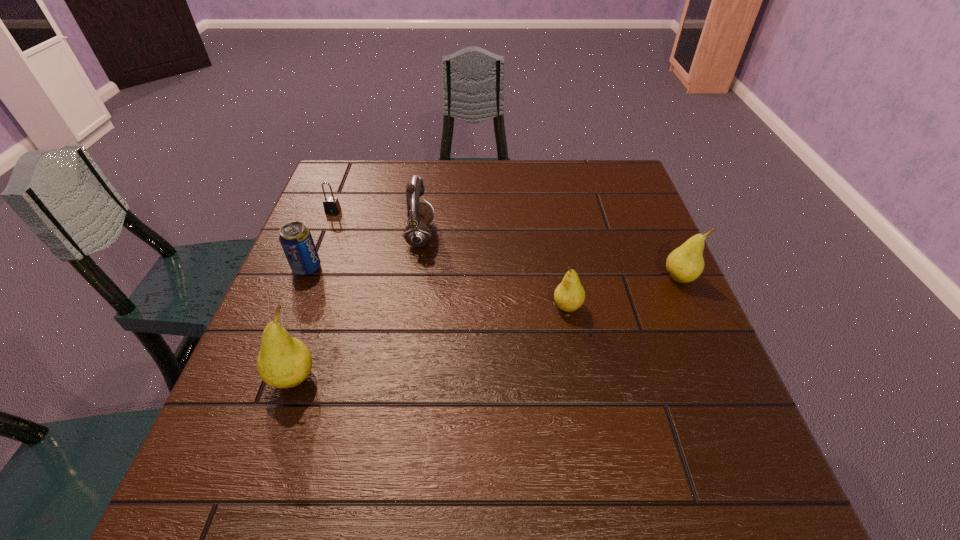
Image resolution: width=960 pixels, height=540 pixels. Identify the location of padlock situated at the left edge. (331, 204).

The width and height of the screenshot is (960, 540). What are the coordinates of `object that is at the right edge` in the screenshot? It's located at (684, 264).

This screenshot has height=540, width=960. I want to click on object located in the near left corner section of the desktop, so click(283, 362).

In the image, there is a desktop. Where is `free space at the far edge`? free space at the far edge is located at coordinates (537, 171).

Locate an element on the screen. vacant point at the near edge is located at coordinates (381, 425).

In the image, there is a desktop. Where is `vacant area at the left edge`? Image resolution: width=960 pixels, height=540 pixels. vacant area at the left edge is located at coordinates (316, 274).

In the image, there is a desktop. Where is `blank space at the right edge`? blank space at the right edge is located at coordinates (653, 223).

Image resolution: width=960 pixels, height=540 pixels. What are the coordinates of `vacant space at the far left corner` in the screenshot? It's located at coord(366,199).

Where is `blank space at the far right corner of the desktop`? blank space at the far right corner of the desktop is located at coordinates [x=623, y=177].

The image size is (960, 540). Identify the location of free space between the farthest object and the soda. (320, 239).